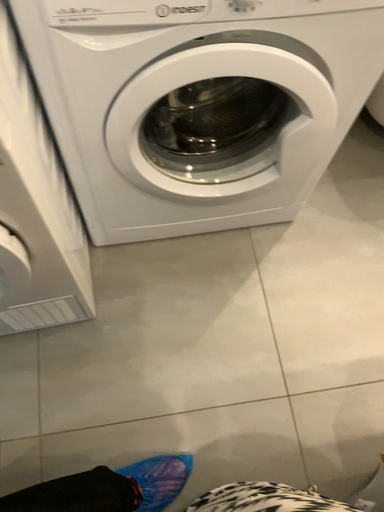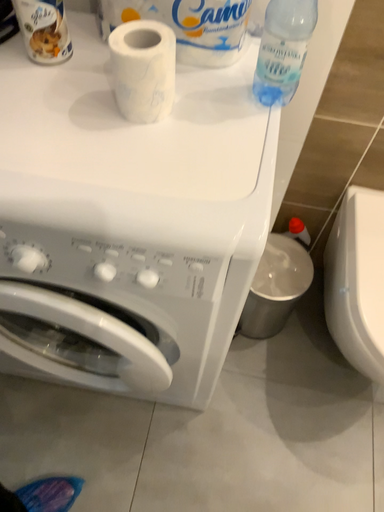
Question: Which way did the camera rotate in the video?

Choices:
 (A) rotated left
 (B) rotated right

Answer: (A)